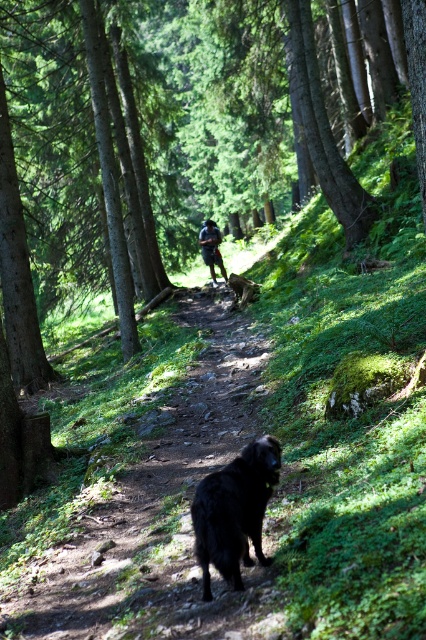
You are a hiker who needs to catch up with the person wearing a dark blue fabric shirt at center. The black furry dog at center is blocking your path. If you walk around the dog, will you be able to reach the person before they disappear around the bend in the path?

The distance between the black furry dog at center and the dark blue fabric shirt at center is 59.27 feet. Since the dog is blocking your path, you would need to detour around it, but the total distance to the person remains approximately 59.27 feet. Whether you can reach them before they disappear depends on your speed and the person walking further away.

You are standing at the starting point of the forest path and see two points marked on the dirt path ahead. The first point is at coordinate point(204, 289) and the second is at point(206, 504). Which point is closer to you as you walk along the path?

Point(206, 504) is closer to you because point(204, 289) is behind it along the path.